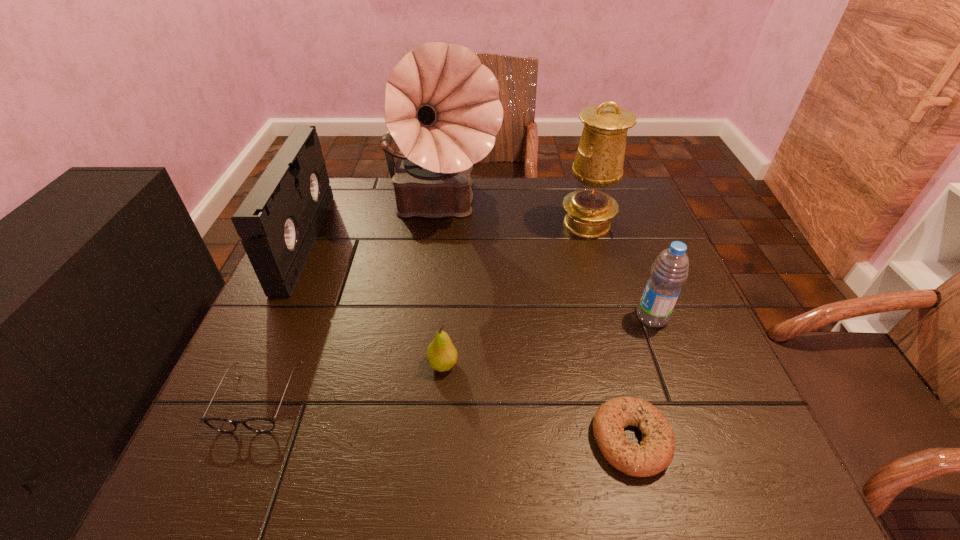
You are a GUI agent. You are given a task and a screenshot of the screen. Output one action in this format:
    pyautogui.click(x=<x>, y=<y>)
    Task: Click on the tallest object
    This screenshot has width=960, height=540.
    Given the screenshot: What is the action you would take?
    442,109

Locate an element on the screen. Image resolution: width=960 pixels, height=540 pixels. oil lamp is located at coordinates (599, 160).

Image resolution: width=960 pixels, height=540 pixels. What are the coordinates of `videotape` in the screenshot? It's located at (279, 220).

Where is `water bottle`? This screenshot has width=960, height=540. water bottle is located at coordinates (669, 271).

You are a GUI agent. You are given a task and a screenshot of the screen. Output one action in this format:
    pyautogui.click(x=<x>, y=<y>)
    Task: Click on the third shortest object
    The width and height of the screenshot is (960, 540).
    Given the screenshot: What is the action you would take?
    pyautogui.click(x=441, y=355)

Locate an element on the screen. The image size is (960, 540). spectacles is located at coordinates (261, 425).

Where is `bagel`? bagel is located at coordinates (655, 453).

Find the location of a particular element. The width and height of the screenshot is (960, 540). vacant space located from the horn of the tallest object is located at coordinates (430, 308).

Find the location of a particular element. This screenshot has height=540, width=960. free location located 0.270m on the front of the second tallest object is located at coordinates (614, 318).

Locate an element on the screen. The height and width of the screenshot is (540, 960). free space located 0.200m on the side of the videotape with visible spindles is located at coordinates (392, 242).